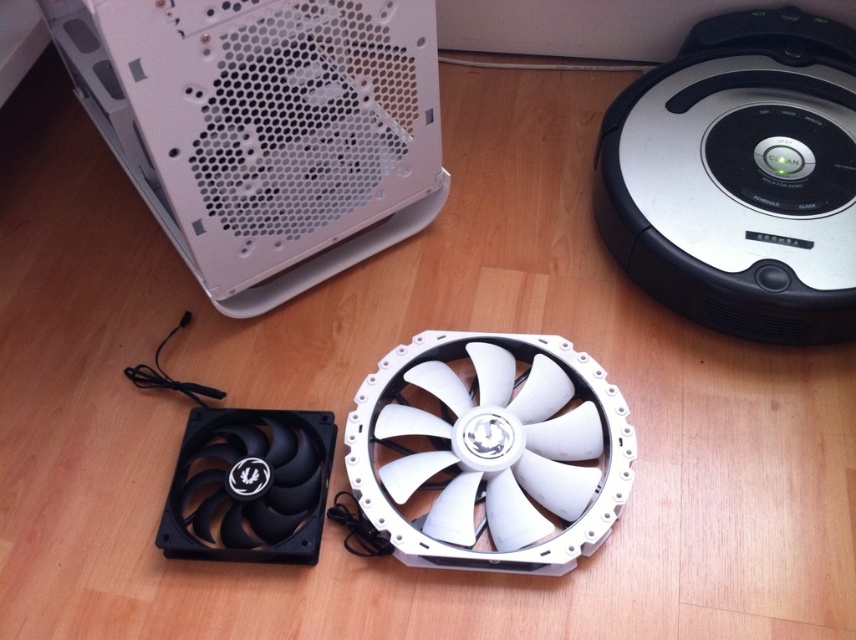
Question: Can you confirm if white matte computer case at upper left is positioned to the left of white plastic fan at center?

Choices:
 (A) no
 (B) yes

Answer: (B)

Question: Which object appears closest to the camera in this image?

Choices:
 (A) black plastic fan at lower left
 (B) white plastic fan at center
 (C) white matte computer case at upper left

Answer: (C)

Question: Which point is closer to the camera taking this photo?

Choices:
 (A) (58, 51)
 (B) (171, 481)
 (C) (593, 371)

Answer: (B)

Question: Among these points, which one is nearest to the camera?

Choices:
 (A) (269, 538)
 (B) (302, 136)

Answer: (A)

Question: Is white plastic fan at center smaller than black plastic fan at lower left?

Choices:
 (A) yes
 (B) no

Answer: (B)

Question: Does white matte computer case at upper left have a lesser width compared to black plastic fan at lower left?

Choices:
 (A) no
 (B) yes

Answer: (A)